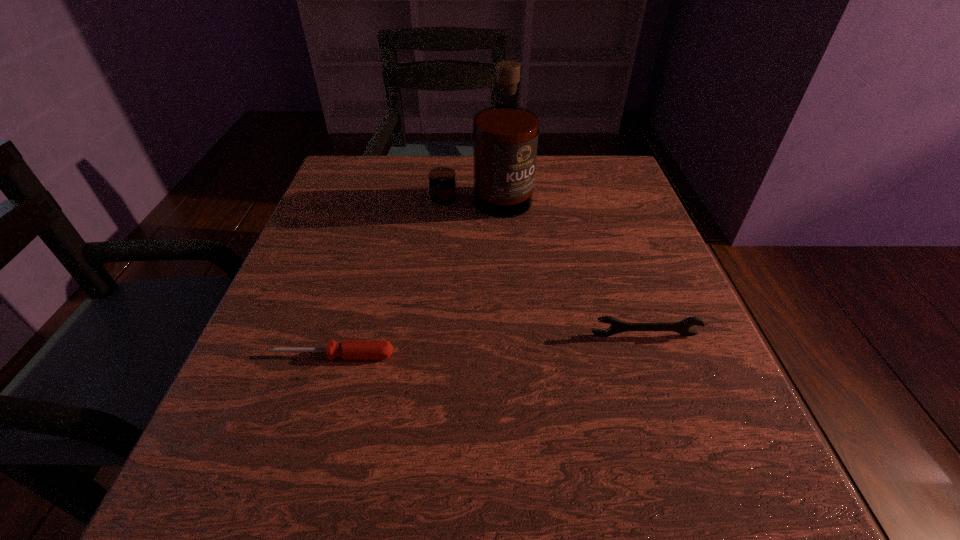
You are a GUI agent. You are given a task and a screenshot of the screen. Output one action in this format:
    pyautogui.click(x=<x>, y=<y>)
    Task: Click on the tallest object
    The image size is (960, 540).
    Given the screenshot: What is the action you would take?
    pyautogui.click(x=505, y=137)

Find the location of a particular element. the second object from right to left is located at coordinates (505, 137).

Where is `the second tallest object`? This screenshot has width=960, height=540. the second tallest object is located at coordinates (617, 326).

Where is `the rightmost object`? The height and width of the screenshot is (540, 960). the rightmost object is located at coordinates (617, 326).

Locate an element on the screen. Image resolution: width=960 pixels, height=540 pixels. the nearest object is located at coordinates point(349,349).

Where is `the leftmost object`? the leftmost object is located at coordinates (349, 349).

Locate an element on the screen. The height and width of the screenshot is (540, 960). vacant region located on the front label of the liquor is located at coordinates (481, 351).

I want to click on vacant area situated 0.260m on the open ends of the wrench, so click(704, 505).

The image size is (960, 540). Identify the location of vacant region located on the back of the shortest object. (350, 295).

Find the location of a particular element. The image size is (960, 540). object located in the far edge section of the desktop is located at coordinates (505, 137).